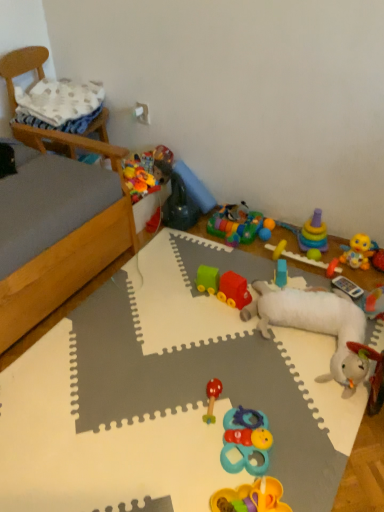
The height and width of the screenshot is (512, 384). What are the coordinates of `vacant point to the right of rubberized plastic train at center, which is counted as the 4th toy, starting from the bottom` in the screenshot? It's located at (259, 280).